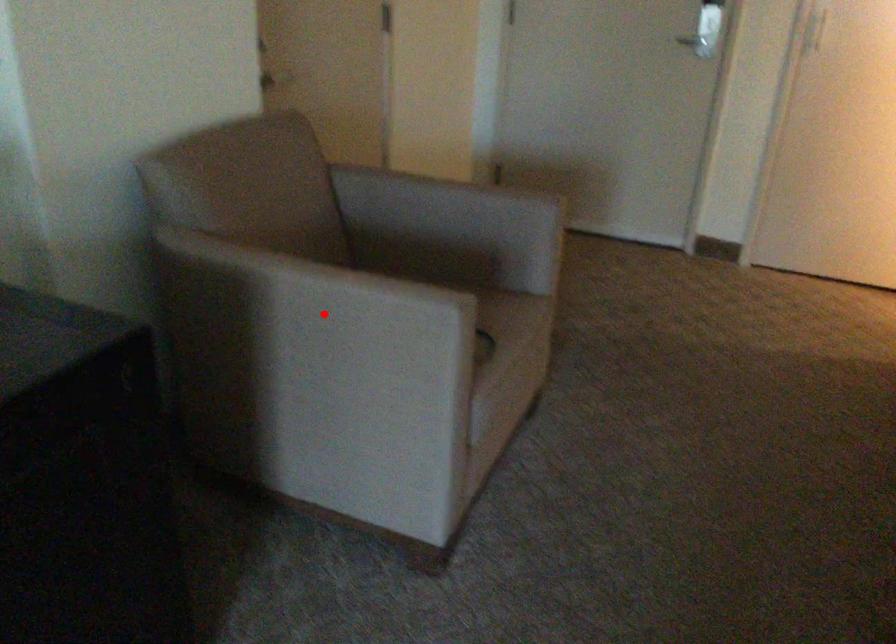
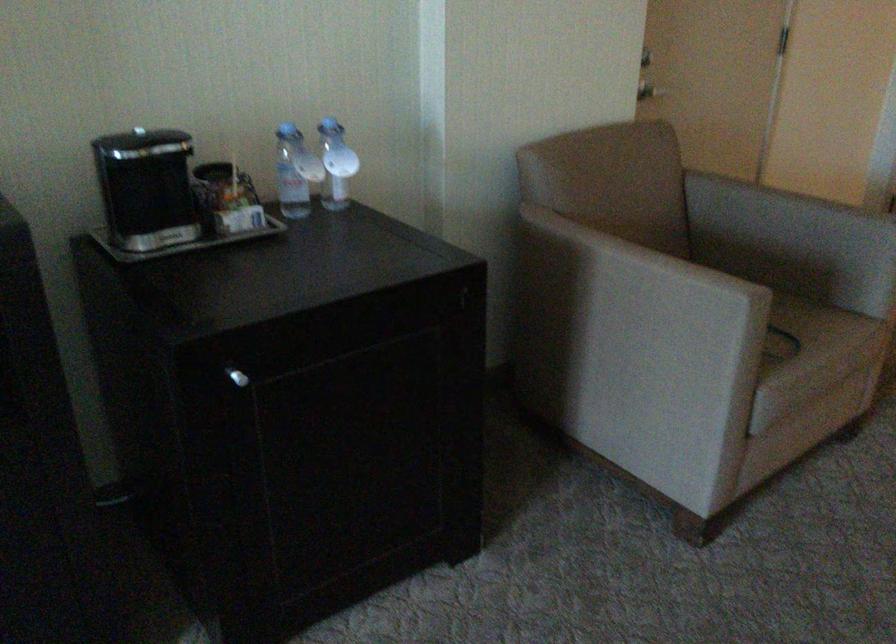
In the second image, find the point that corresponds to the highlighted location in the first image.

(631, 283)